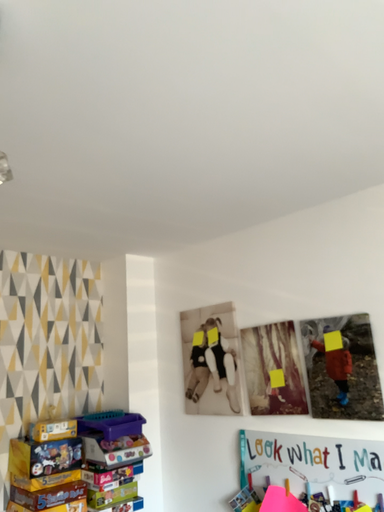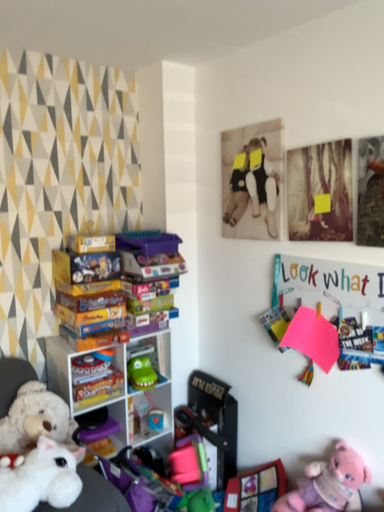
Question: Which way did the camera rotate in the video?

Choices:
 (A) rotated left
 (B) rotated right

Answer: (A)